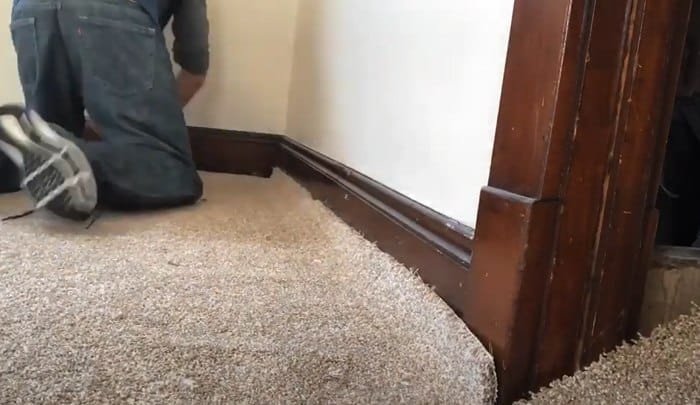
In order to click on light beige walls in this screenshot , I will do `click(425, 61)`, `click(248, 56)`.